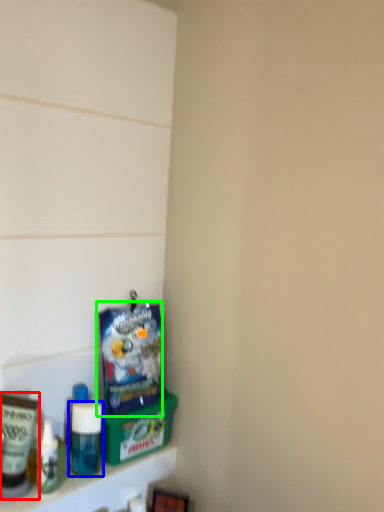
Question: Which is nearer to the toiletry (highlighted by a red box)? bottle (highlighted by a blue box) or product (highlighted by a green box).

Choices:
 (A) bottle
 (B) product

Answer: (A)